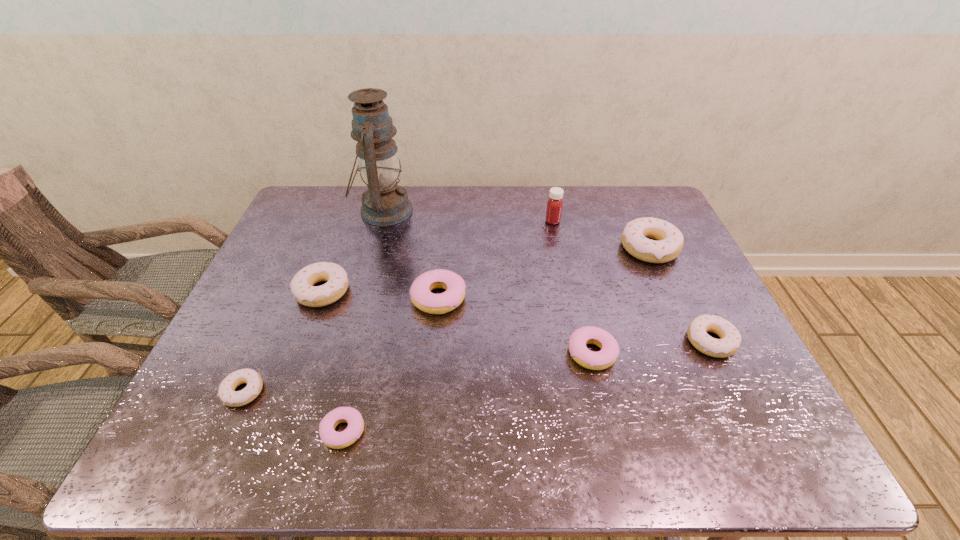
Find the location of `oil lamp`. oil lamp is located at coordinates (384, 203).

Where is `medicine`? This screenshot has height=540, width=960. medicine is located at coordinates (555, 203).

Find the location of a particular element. the eighth shortest object is located at coordinates click(x=555, y=203).

Image resolution: width=960 pixels, height=540 pixels. In order to click on the seventh shortest object in this screenshot , I will do `click(670, 240)`.

Locate an element on the screen. the biggest white doughnut is located at coordinates (670, 240).

The image size is (960, 540). What are the coordinates of `the second biggest white doughnut` in the screenshot? It's located at (304, 292).

Locate an element on the screen. The width and height of the screenshot is (960, 540). the second pink doughnut from left to right is located at coordinates (422, 297).

Locate an element on the screen. The height and width of the screenshot is (540, 960). the fifth object from left to right is located at coordinates (422, 297).

Where is `the third biggest white doughnut`? The image size is (960, 540). the third biggest white doughnut is located at coordinates (730, 341).

The image size is (960, 540). I want to click on the third doughnut from right to left, so click(x=606, y=357).